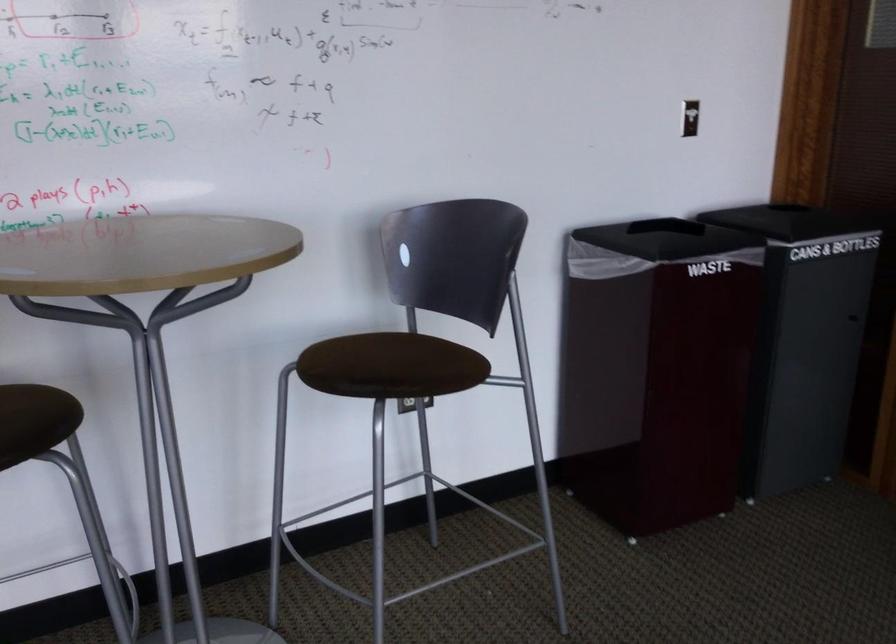
Find the location of a particular element. The image size is (896, 644). light switch is located at coordinates (690, 118).